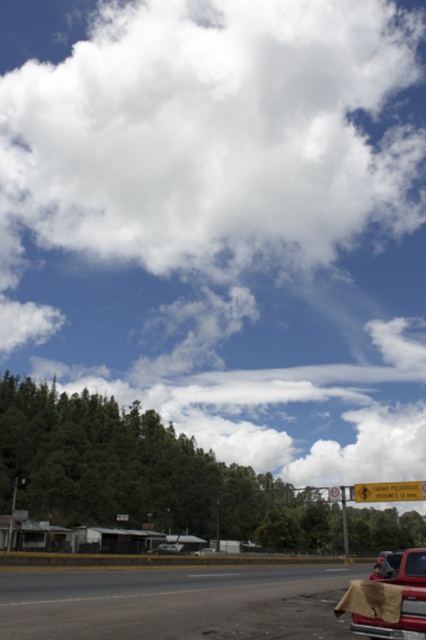
Based on the photo, you are standing on the road in the image and looking up at the sky. Which direction should you turn to see the white fluffy cloud at upper center?

The white fluffy cloud at upper center is located at point coordinates of (212, 134), so you should turn your head slightly to the left and look upwards to see it.

You are driving a metallic silver car at center and want to avoid hitting the metallic pole at center. Which object is taller and needs to be navigated around carefully?

The metallic pole at center is taller than the metallic silver car at center, so you need to navigate around it carefully to avoid collision.